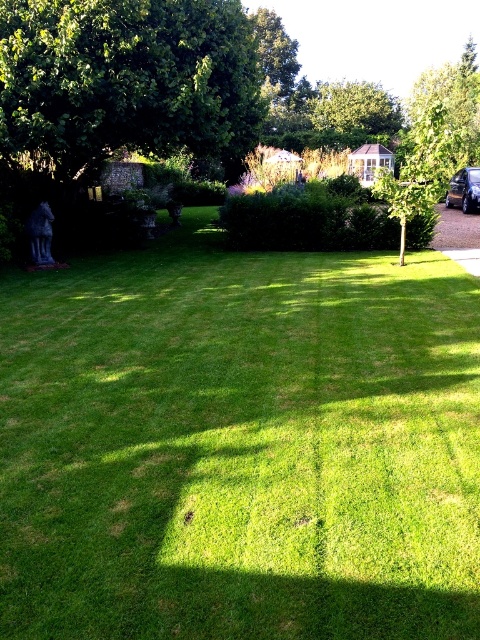
Question: Does green leafy tree at center appear on the right side of green leafy tree at upper center?

Choices:
 (A) no
 (B) yes

Answer: (B)

Question: Which of these objects is positioned farthest from the green leafy tree at center?

Choices:
 (A) shiny black car at right
 (B) green leafy tree at upper center

Answer: (B)

Question: Which of these objects is positioned closest to the shiny black car at right?

Choices:
 (A) green leafy tree at upper center
 (B) green leafy tree at center
 (C) green leafy tree at upper left
 (D) green grass at center

Answer: (B)

Question: Does green grass at center have a smaller size compared to green leafy tree at upper center?

Choices:
 (A) yes
 (B) no

Answer: (A)

Question: Does green grass at center appear over green leafy tree at center?

Choices:
 (A) yes
 (B) no

Answer: (B)

Question: Which of the following is the closest to the observer?

Choices:
 (A) (437, 104)
 (B) (191, 118)

Answer: (B)